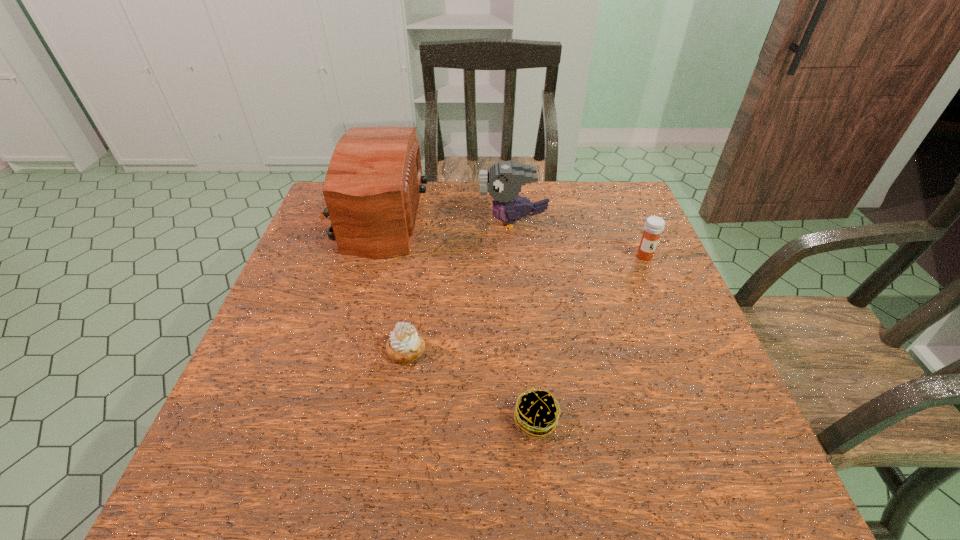
This screenshot has width=960, height=540. I want to click on the tallest object, so click(372, 188).

Locate an element on the screen. This screenshot has height=540, width=960. the second tallest object is located at coordinates (503, 181).

The image size is (960, 540). I want to click on the third tallest object, so click(654, 225).

The height and width of the screenshot is (540, 960). Identify the location of medicine. (654, 225).

Identify the location of pastry. This screenshot has width=960, height=540. (405, 345).

Find the location of a particular element. The image size is (960, 540). patty is located at coordinates point(536,412).

Find the location of `free spot located 0.260m on the front-facing side of the tallest object`. free spot located 0.260m on the front-facing side of the tallest object is located at coordinates (514, 217).

I want to click on vacant position located at the beak of the bird, so click(346, 222).

Find the location of a particular element. free space located at the beak of the bird is located at coordinates (459, 222).

You are a GUI agent. You are given a task and a screenshot of the screen. Output one action in this format:
    pyautogui.click(x=<x>, y=<y>)
    Task: Click on the vacant space located 0.260m at the beak of the bird
    The width and height of the screenshot is (960, 540).
    Given the screenshot: What is the action you would take?
    pyautogui.click(x=390, y=222)